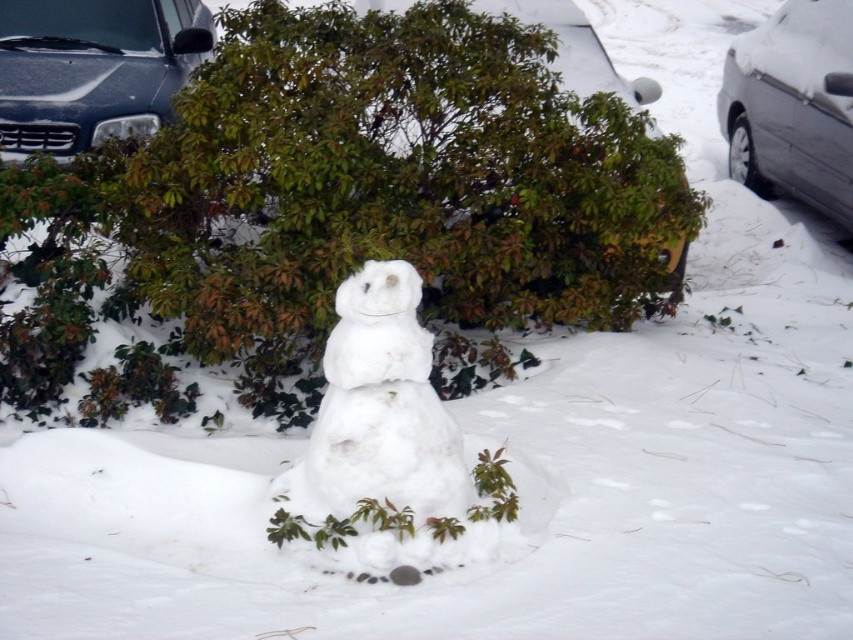
Question: Which point is farther to the camera?

Choices:
 (A) (67, 129)
 (B) (418, 413)

Answer: (A)

Question: Does shiny black car at upper left appear on the right side of sleek silver sedan at right?

Choices:
 (A) no
 (B) yes

Answer: (A)

Question: Which object is the closest to the sleek silver sedan at right?

Choices:
 (A) shiny black car at upper left
 (B) white fluffy snowman at center

Answer: (A)

Question: Is shiny black car at upper left positioned behind sleek silver sedan at right?

Choices:
 (A) no
 (B) yes

Answer: (A)

Question: Among these objects, which one is farthest from the camera?

Choices:
 (A) shiny black car at upper left
 (B) sleek silver sedan at right

Answer: (B)

Question: Is shiny black car at upper left wider than sleek silver sedan at right?

Choices:
 (A) no
 (B) yes

Answer: (B)